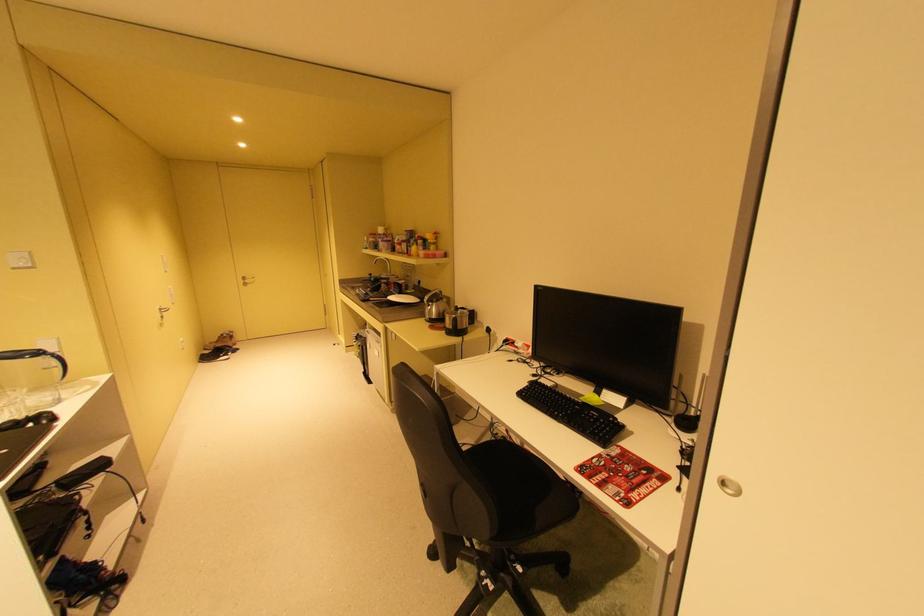
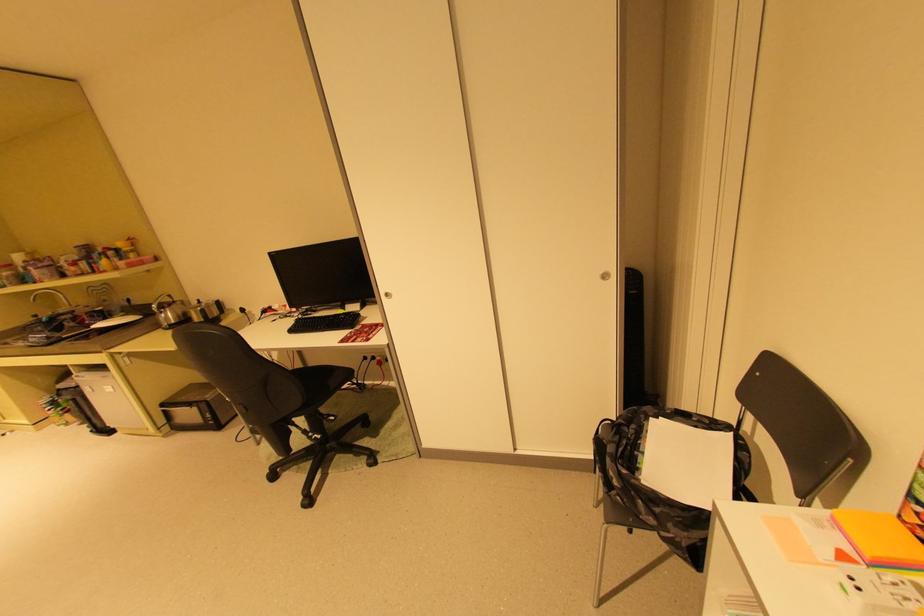
Where in the second image is the point corresponding to (433,376) from the first image?

(199, 385)